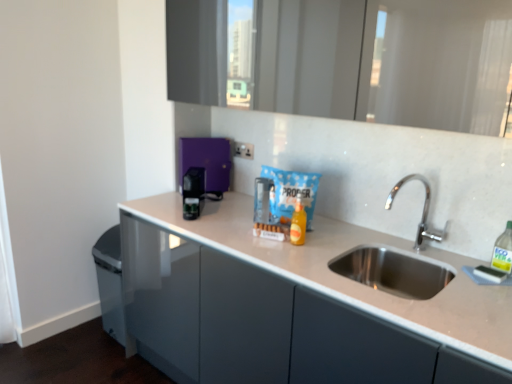
Where is `free space between translucent orange bottle at center, which is the first bottle from back to front, and black plastic coffee machine at center, the 1th appliance in the front-to-back sequence`? Image resolution: width=512 pixels, height=384 pixels. free space between translucent orange bottle at center, which is the first bottle from back to front, and black plastic coffee machine at center, the 1th appliance in the front-to-back sequence is located at coordinates (224, 218).